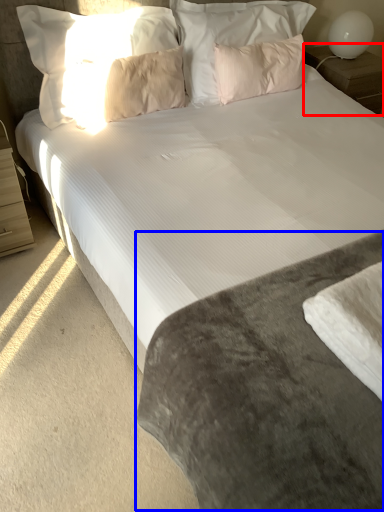
Question: Which object is closer to the camera taking this photo, nightstand (highlighted by a red box) or mattress (highlighted by a blue box)?

Choices:
 (A) nightstand
 (B) mattress

Answer: (B)